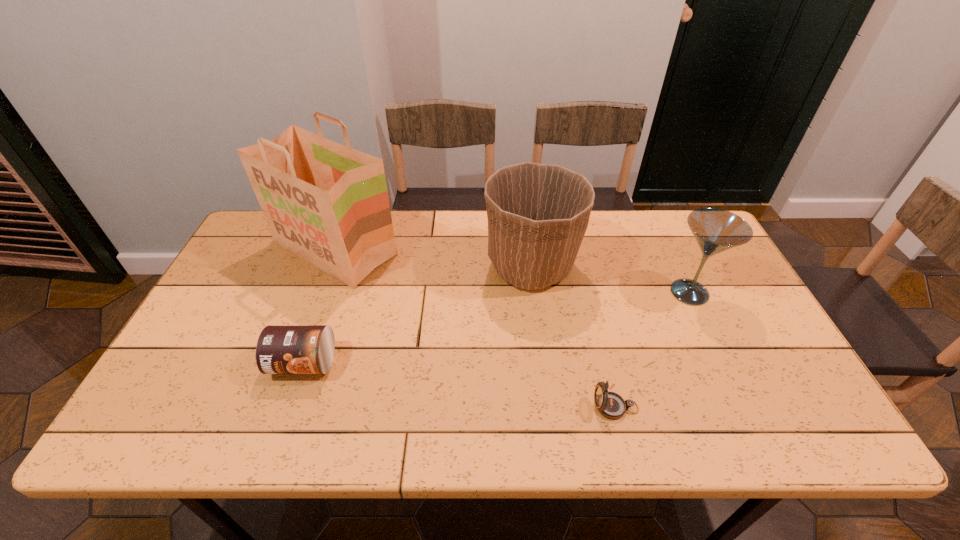
Find the location of a particular element. The image size is (960, 540). the tallest object is located at coordinates (327, 203).

Find the location of a particular element. The width and height of the screenshot is (960, 540). flowerpot is located at coordinates (538, 214).

This screenshot has height=540, width=960. Find the location of `the third tallest object`. the third tallest object is located at coordinates (715, 230).

You are a GUI agent. You are given a task and a screenshot of the screen. Output one action in this format:
    pyautogui.click(x=<x>, y=<y>)
    Task: Click on the rightmost object
    Image resolution: width=960 pixels, height=540 pixels.
    Given the screenshot: What is the action you would take?
    pyautogui.click(x=715, y=230)

Locate an element on the screen. the fourth farthest object is located at coordinates (281, 349).

At what (x,y) coordinates should I click in order to perform the action: click on compass. Please return your answer as a coordinate pair (x, y). The height and width of the screenshot is (540, 960). Looking at the image, I should click on (611, 405).

Identify the location of free region located 0.110m on the right of the tallest object. The image size is (960, 540). (434, 249).

The width and height of the screenshot is (960, 540). I want to click on vacant space located on the right of the fourth shortest object, so click(618, 267).

You are a GUI agent. You are given a task and a screenshot of the screen. Output one action in this format:
    pyautogui.click(x=<x>, y=<y>)
    Task: Click on the blank space located 0.280m on the left of the third tallest object
    This screenshot has width=960, height=540.
    Given the screenshot: What is the action you would take?
    pyautogui.click(x=564, y=293)

Locate an element on the screen. The width and height of the screenshot is (960, 540). free space located 0.070m on the front label of the second nearest object is located at coordinates (287, 410).